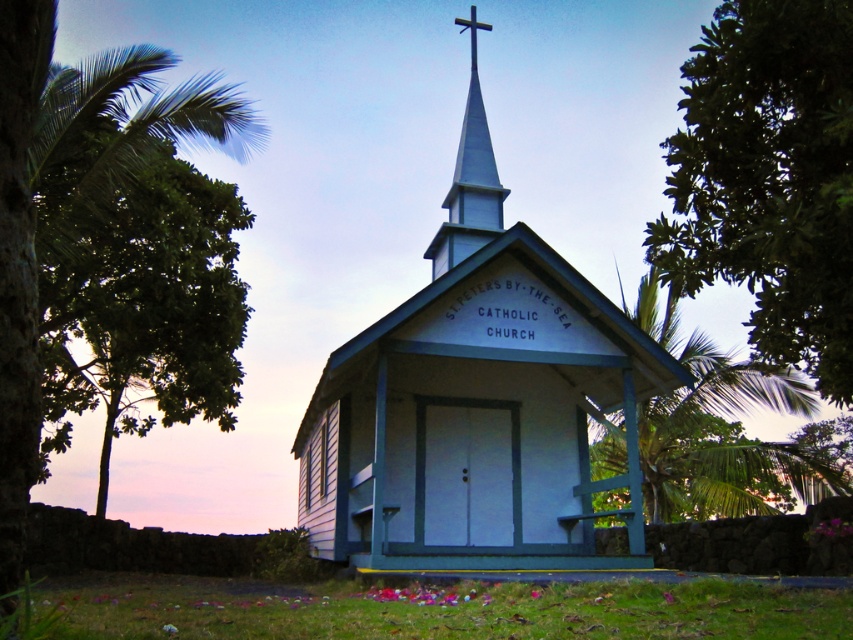
Can you confirm if green leafy palm tree at upper center is positioned to the right of metallic cross at upper center?

Indeed, green leafy palm tree at upper center is positioned on the right side of metallic cross at upper center.

Is point (728, 384) positioned before point (473, 67)?

Yes, it is in front of point (473, 67).

This screenshot has height=640, width=853. Find the location of `green leafy palm tree at upper center`. green leafy palm tree at upper center is located at coordinates (724, 429).

Based on the photo, does green leafy tree at upper right have a lesser width compared to metallic cross at upper center?

In fact, green leafy tree at upper right might be wider than metallic cross at upper center.

Does green leafy tree at upper right appear on the left side of metallic cross at upper center?

Incorrect, green leafy tree at upper right is not on the left side of metallic cross at upper center.

At what (x,y) coordinates should I click in order to perform the action: click on green leafy tree at upper right. Please return your answer as a coordinate pair (x, y). Looking at the image, I should click on (769, 179).

I want to click on green leafy tree at upper right, so click(x=769, y=179).

Is white smooth steeple at center to the right of metallic cross at upper center from the viewer's perspective?

No, white smooth steeple at center is not to the right of metallic cross at upper center.

Does white smooth steeple at center lie in front of metallic cross at upper center?

Yes, it is in front of metallic cross at upper center.

Is point (502, 198) closer to viewer compared to point (480, 22)?

Yes.

Identify the location of white smooth steeple at center. The width and height of the screenshot is (853, 640). (469, 179).